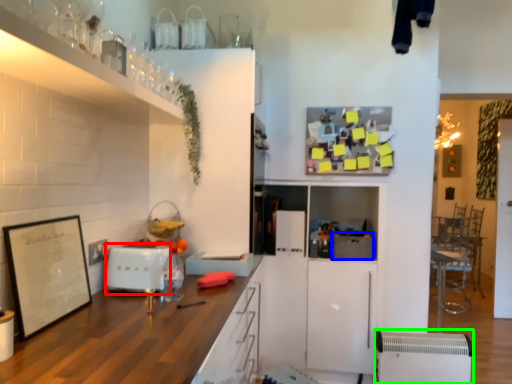
Question: Which is farther away from appliance (highlighted by a red box)? appliance (highlighted by a blue box) or appliance (highlighted by a green box)?

Choices:
 (A) appliance
 (B) appliance

Answer: (B)